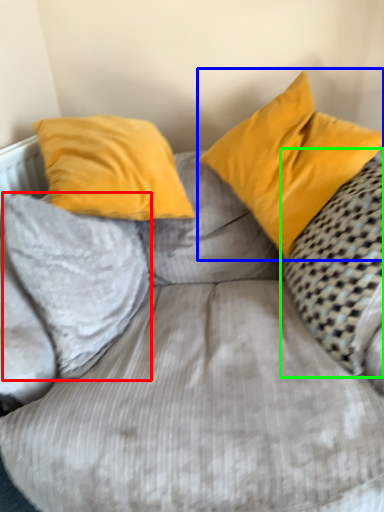
Question: Considering the real-world distances, which object is closest to pillow (highlighted by a red box)? pillow (highlighted by a blue box) or pillow (highlighted by a green box).

Choices:
 (A) pillow
 (B) pillow

Answer: (A)